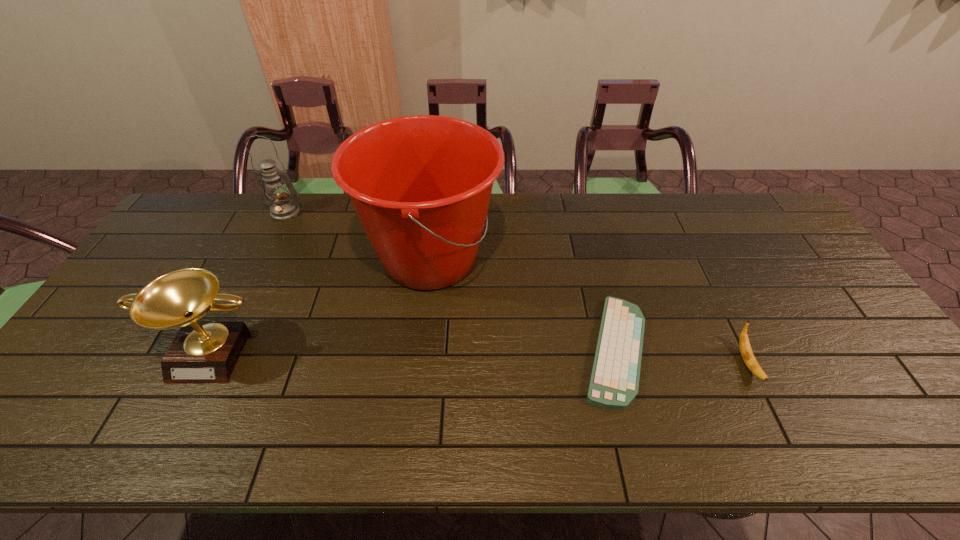
The width and height of the screenshot is (960, 540). Find the location of `free region located on the front-facing side of the third shortest object`. free region located on the front-facing side of the third shortest object is located at coordinates (169, 440).

This screenshot has height=540, width=960. Identify the location of free space located on the peel of the second shortest object from the top. (790, 451).

This screenshot has width=960, height=540. Identify the location of free space located on the back of the computer keyboard. (592, 262).

This screenshot has width=960, height=540. Identify the location of bucket at the far edge. (421, 185).

Locate an element on the screen. oil lamp located in the far edge section of the desktop is located at coordinates (282, 208).

Find the location of a particular element. The image size is (960, 540). vacant space at the far edge of the desktop is located at coordinates (551, 208).

In the image, there is a desktop. Identify the location of vacant space at the left edge. (116, 334).

I want to click on vacant region at the right edge of the desktop, so click(x=852, y=351).

At what (x,y) coordinates should I click in order to perform the action: click on free space at the far left corner of the desktop. Please return your answer as a coordinate pair (x, y). The image size is (960, 540). Looking at the image, I should click on (204, 200).

Identify the location of vacant space at the far right corner. (777, 227).